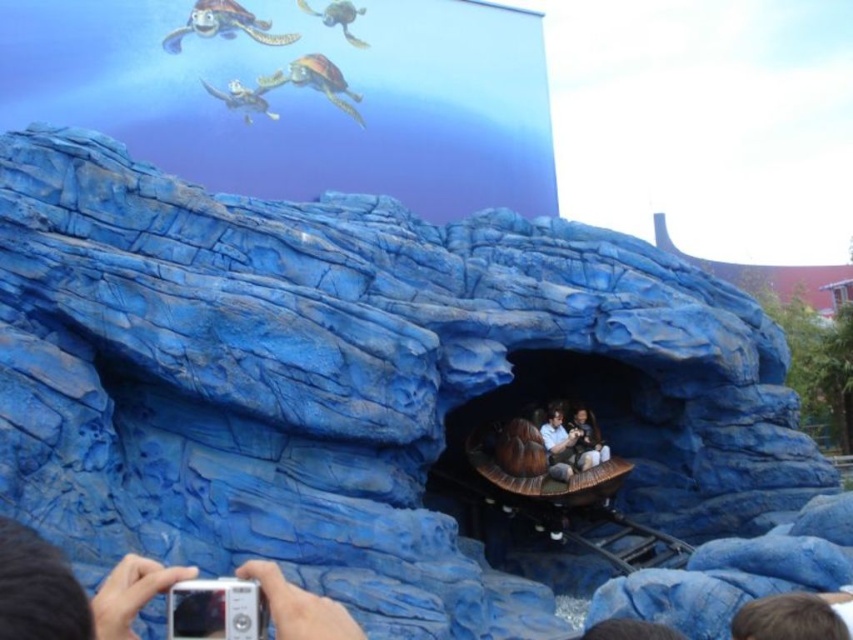
You are a photographer trying to capture a photo of the smooth brown wooden boat at center. There is a silver metallic camera at lower left. Can you use this camera to take a clear picture of the boat without any obstructions?

The silver metallic camera at lower left is to the left of smooth brown wooden boat at center, so the camera is positioned in a way that it can capture the boat without obstruction as long as there are no other objects blocking the view between them.

You are a photographer trying to capture a clear image of the smooth brown wooden boat at center using the silver metallic camera at lower left. Can you take a photo without the camera being in the boat image?

The silver metallic camera at lower left is closer to the viewer than the smooth brown wooden boat at center, so when taking a photo of the boat, the camera would be positioned in front of it and likely not obstructing the view. Therefore, you can take a clear photo of the smooth brown wooden boat at center without the camera appearing in the image.